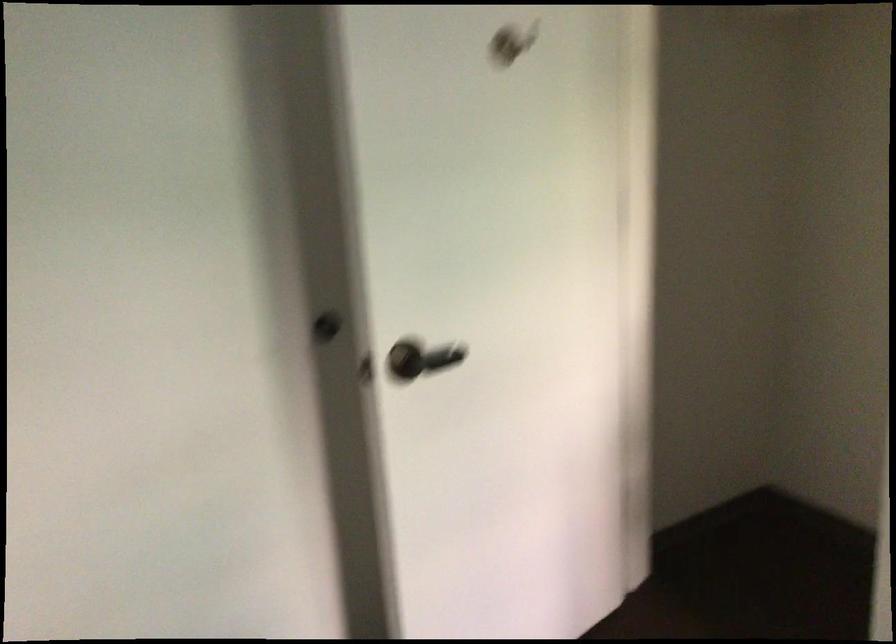
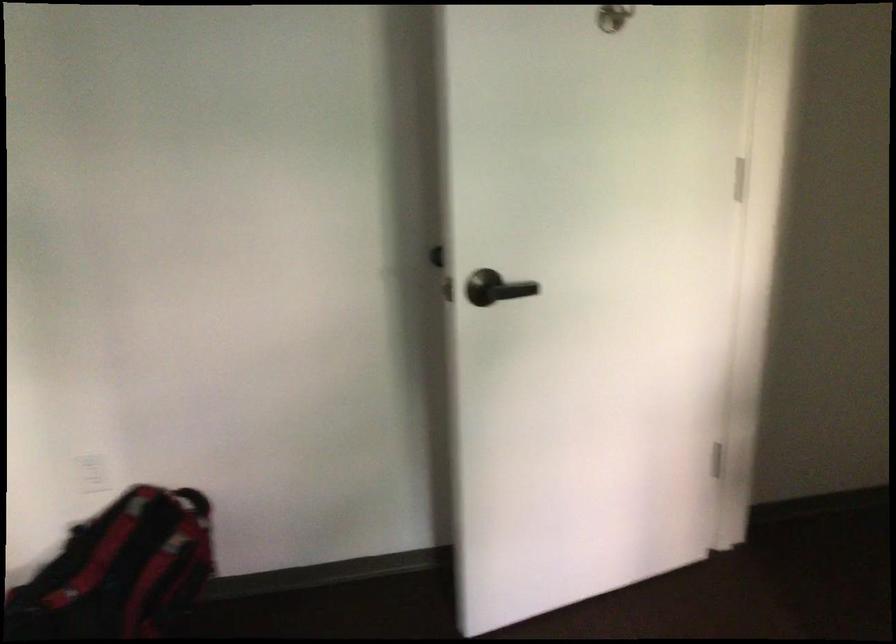
Question: The images are taken continuously from a first-person perspective. In which direction is your viewpoint rotating?

Choices:
 (A) Left
 (B) Right
 (C) Up
 (D) Down

Answer: (A)